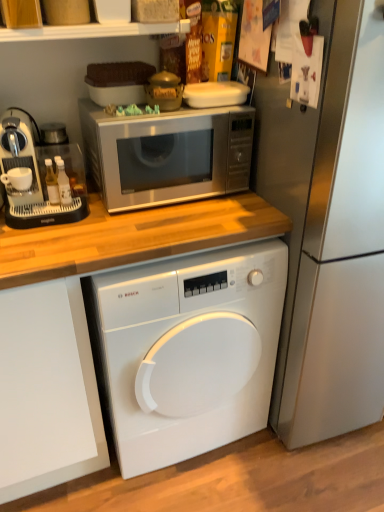
Question: From a real-world perspective, is white glossy shelf at upper center below satin silver refrigerator at right?

Choices:
 (A) no
 (B) yes

Answer: (A)

Question: From the image's perspective, is white glossy shelf at upper center on satin silver refrigerator at right?

Choices:
 (A) no
 (B) yes

Answer: (B)

Question: Is satin silver refrigerator at right a part of white glossy shelf at upper center?

Choices:
 (A) yes
 (B) no

Answer: (B)

Question: Considering the relative sizes of white glossy shelf at upper center and satin silver refrigerator at right in the image provided, is white glossy shelf at upper center wider than satin silver refrigerator at right?

Choices:
 (A) no
 (B) yes

Answer: (A)

Question: Is white glossy shelf at upper center positioned behind satin silver refrigerator at right?

Choices:
 (A) no
 (B) yes

Answer: (B)

Question: Looking at their shapes, would you say white plastic coffee machine at left is wider or thinner than white matte plastic container at upper center?

Choices:
 (A) wide
 (B) thin

Answer: (A)

Question: Considering the positions of point (4, 157) and point (226, 81), is point (4, 157) closer or farther from the camera than point (226, 81)?

Choices:
 (A) farther
 (B) closer

Answer: (B)

Question: Based on their positions, is white plastic coffee machine at left located to the left or right of white matte plastic container at upper center?

Choices:
 (A) left
 (B) right

Answer: (A)

Question: From a real-world perspective, is white plastic coffee machine at left positioned above or below white matte plastic container at upper center?

Choices:
 (A) below
 (B) above

Answer: (A)

Question: Considering the positions of white matte plastic container at upper center and satin silver refrigerator at right in the image, is white matte plastic container at upper center taller or shorter than satin silver refrigerator at right?

Choices:
 (A) tall
 (B) short

Answer: (B)

Question: From the image's perspective, is white matte plastic container at upper center located above or below satin silver refrigerator at right?

Choices:
 (A) below
 (B) above

Answer: (B)

Question: Relative to satin silver refrigerator at right, is white matte plastic container at upper center in front or behind?

Choices:
 (A) front
 (B) behind

Answer: (B)

Question: In terms of size, does white matte plastic container at upper center appear bigger or smaller than satin silver refrigerator at right?

Choices:
 (A) small
 (B) big

Answer: (A)

Question: From the image's perspective, is satin silver refrigerator at right positioned above or below satin silver microwave at upper center?

Choices:
 (A) above
 (B) below

Answer: (B)

Question: Is satin silver refrigerator at right in front of or behind satin silver microwave at upper center in the image?

Choices:
 (A) behind
 (B) front

Answer: (B)